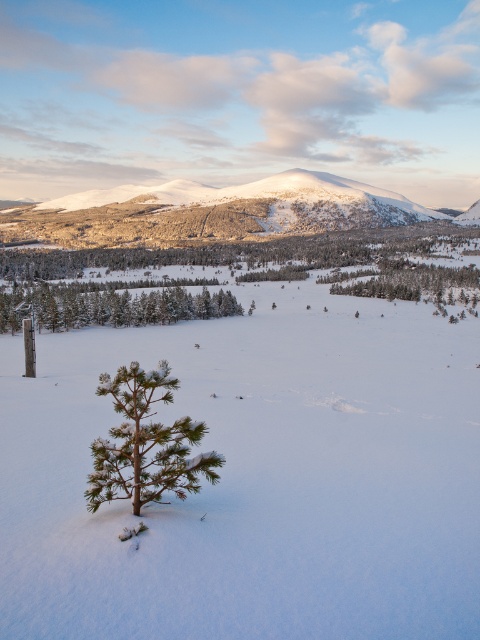
You are standing at the point marked as point (145, 444) in the winter landscape. What object is located exactly at that point?

The green matte pine tree at center is located exactly at point (145, 444).

You are standing at the edge of the forest and see the green matte pine tree at center and the green matte tree at lower left. Which tree is positioned to the right when facing the scene?

The green matte pine tree at center is positioned to the right of the green matte tree at lower left.

You are an observer standing in the winter landscape. You notice the green matte pine tree at center and the green matte tree at lower left. Which of these two trees is narrower in width?

The green matte pine tree at center has a lesser width compared to the green matte tree at lower left, so it is narrower.